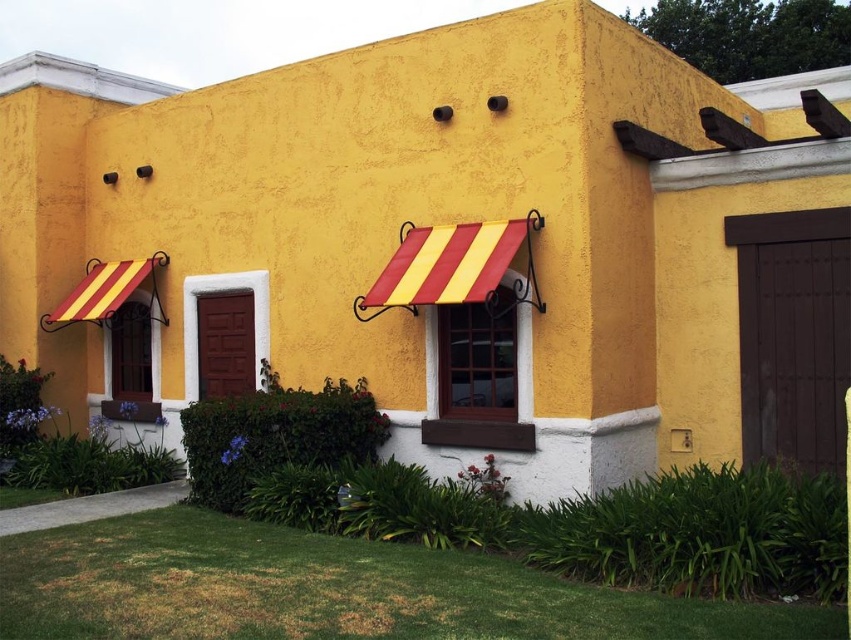
Between point (203, 381) and point (141, 358), which one is positioned behind?

The point (141, 358) is more distant.

Between matte wood door at center and yellow striped awning at left, which one has less height?

matte wood door at center is shorter.

Is point (216, 392) closer to viewer compared to point (136, 362)?

Yes, point (216, 392) is closer to viewer.

You are a GUI agent. You are given a task and a screenshot of the screen. Output one action in this format:
    pyautogui.click(x=<x>, y=<y>)
    Task: Click on the matte wood door at center
    This screenshot has width=851, height=640.
    Given the screenshot: What is the action you would take?
    pyautogui.click(x=226, y=344)

Is point (784, 461) less distant than point (124, 397)?

Yes, point (784, 461) is closer to viewer.

Consider the image. Is brown wooden door at right positioned at the back of yellow striped awning at left?

That is False.

This screenshot has height=640, width=851. What are the coordinates of `brown wooden door at right` in the screenshot? It's located at (792, 333).

Which is more to the left, brown wooden door at right or matte wood door at center?

matte wood door at center

The width and height of the screenshot is (851, 640). Find the location of `brown wooden door at right`. brown wooden door at right is located at coordinates (792, 333).

The height and width of the screenshot is (640, 851). What do you see at coordinates (792, 333) in the screenshot? I see `brown wooden door at right` at bounding box center [792, 333].

Identify the location of brown wooden door at right. Image resolution: width=851 pixels, height=640 pixels. (x=792, y=333).